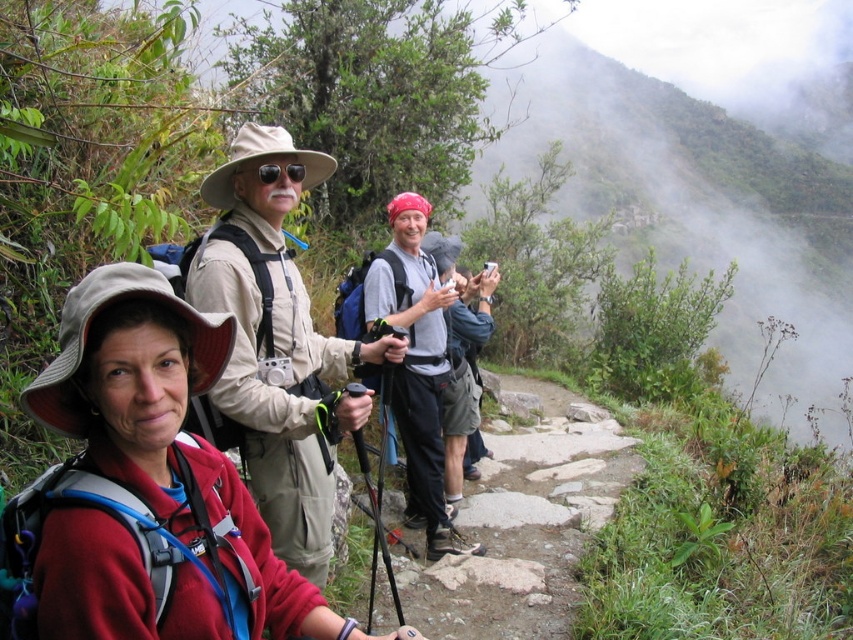
Can you confirm if matte red jacket at center is thinner than black matte sunglasses at center?

Incorrect, matte red jacket at center's width is not less than black matte sunglasses at center's.

Locate an element on the screen. matte red jacket at center is located at coordinates (155, 481).

Where is `matte red jacket at center`? This screenshot has width=853, height=640. matte red jacket at center is located at coordinates (155, 481).

Which is more to the right, matte red jacket at center or tan fabric hat at center?

matte red jacket at center is more to the right.

Does point (144, 572) come behind point (316, 515)?

That is False.

Locate an element on the screen. The image size is (853, 640). matte red jacket at center is located at coordinates (155, 481).

Between gray fabric shirt at center and black matte sunglasses at center, which one appears on the left side from the viewer's perspective?

black matte sunglasses at center

How much distance is there between gray fabric shirt at center and black matte sunglasses at center?

The distance of gray fabric shirt at center from black matte sunglasses at center is 6.85 feet.

The width and height of the screenshot is (853, 640). In order to click on gray fabric shirt at center in this screenshot , I will do `click(416, 365)`.